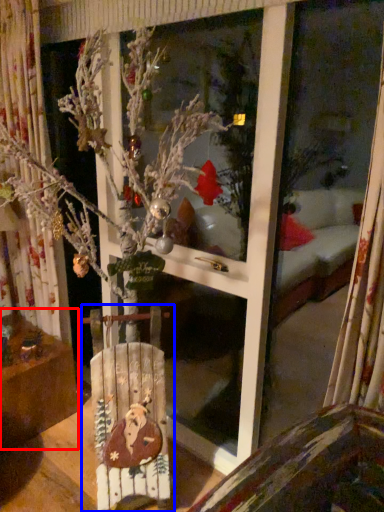
Question: Which point is further to the camera, furniture (highlighted by a red box) or armchair (highlighted by a blue box)?

Choices:
 (A) furniture
 (B) armchair

Answer: (A)